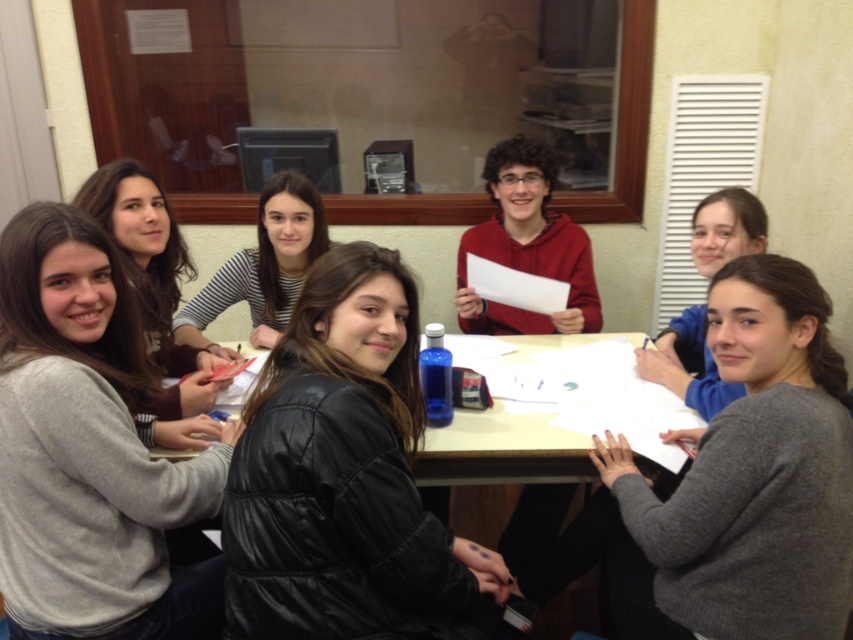
You are a photographer taking a picture of the group around the rectangular table. You need to focus on two specific points in the image, point 1 at coordinates (48, 518) and point 2 at coordinates (271, 310). Which point should you focus on first to ensure that the closer one is in sharp focus?

Point 1 at coordinates (48, 518) is closer to the camera than point 2 at coordinates (271, 310), so you should focus on point 1 first to ensure it is in sharp focus.

Based on the photo, you are standing in the room and see the point at coordinates (263, 266). What object is located at that point?

The point at coordinates (263, 266) is located on the striped fabric shirt at center.

You are an interior designer assessing the seating arrangement. The gray sweater at upper left and the striped fabric shirt at center are two participants. Based on their clothing dimensions, which participant is wearing a narrower garment?

The gray sweater at upper left has a smaller width than the striped fabric shirt at center, so the gray sweater at upper left is wearing a narrower garment.